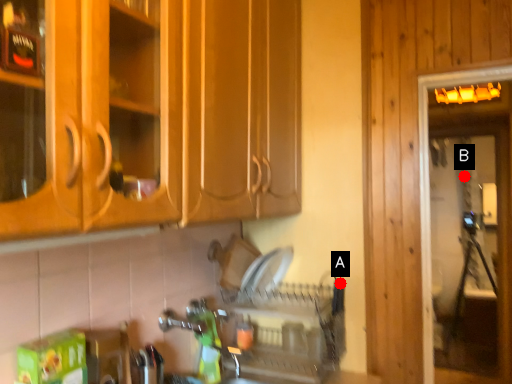
Question: Two points are circled on the image, labeled by A and B beside each circle. Which point is closer to the camera taking this photo?

Choices:
 (A) A is closer
 (B) B is closer

Answer: (A)